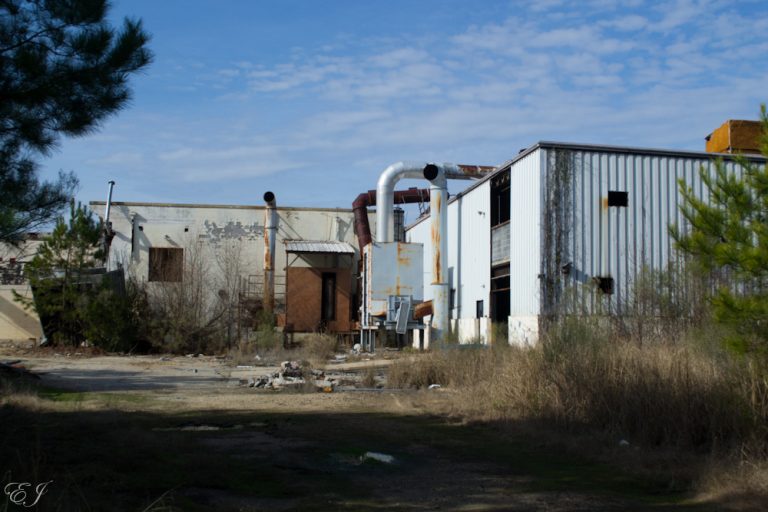
At what (x,y) coordinates should I click in order to perform the action: click on window. Please return your answer as a coordinate pair (x, y). The width and height of the screenshot is (768, 512). Looking at the image, I should click on (164, 267).